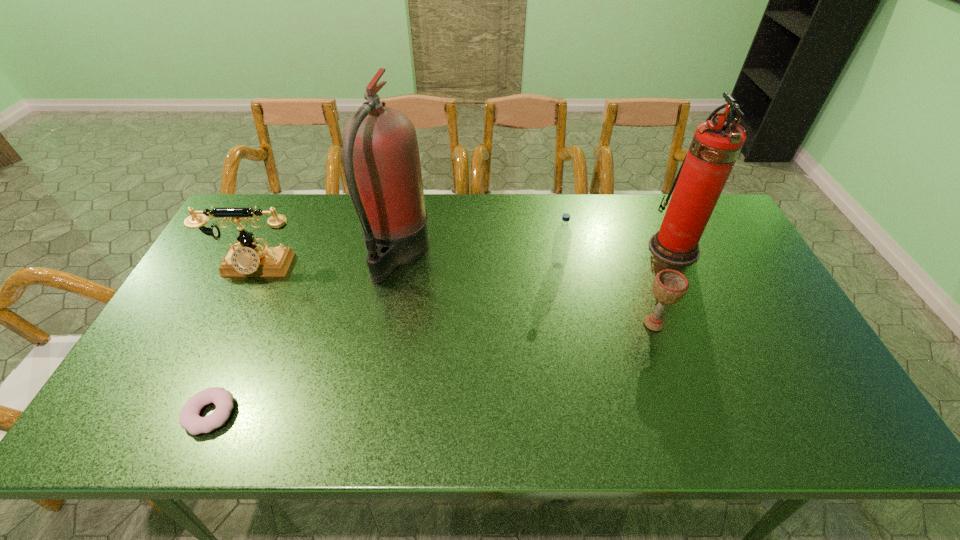
You are a GUI agent. You are given a task and a screenshot of the screen. Output one action in this format:
    pyautogui.click(x=<x>, y=<y>)
    Task: Click on the third object from left to right
    This screenshot has height=540, width=960.
    Given the screenshot: What is the action you would take?
    pyautogui.click(x=381, y=162)

Locate an element on the screen. Image resolution: width=960 pixels, height=540 pixels. the rightmost object is located at coordinates [716, 144].

I want to click on telephone, so click(252, 259).

Find the location of a particular element. the third object from right to left is located at coordinates (563, 234).

Identify the location of the fifth farthest object. (670, 286).

The image size is (960, 540). What are the coordinates of `chalice` in the screenshot? It's located at (670, 286).

You are a GUI agent. You are given a task and a screenshot of the screen. Output one action in this format:
    pyautogui.click(x=<x>, y=<y>)
    Task: Click on the shortest object
    Image resolution: width=960 pixels, height=540 pixels.
    Given the screenshot: What is the action you would take?
    (189, 419)

The width and height of the screenshot is (960, 540). Find the location of `doughnut`. doughnut is located at coordinates (189, 419).

Find the location of `vacant space located 0.300m at the nozzle of the third object from left to right`. vacant space located 0.300m at the nozzle of the third object from left to right is located at coordinates (525, 253).

Image resolution: width=960 pixels, height=540 pixels. I want to click on vacant area situated 0.350m at the discharge end of the rightmost object, so click(x=539, y=248).